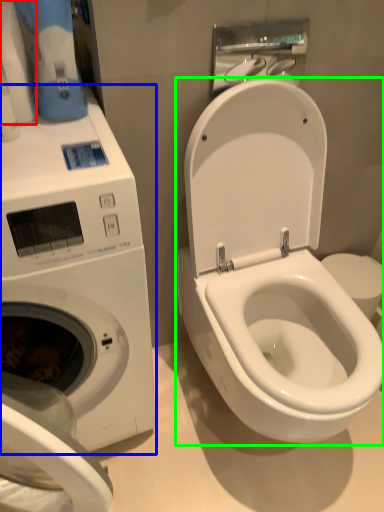
Question: Which object is positioned farthest from toilet paper (highlighted by a red box)? Select from washing machine (highlighted by a blue box) and toilet (highlighted by a green box).

Choices:
 (A) washing machine
 (B) toilet

Answer: (B)